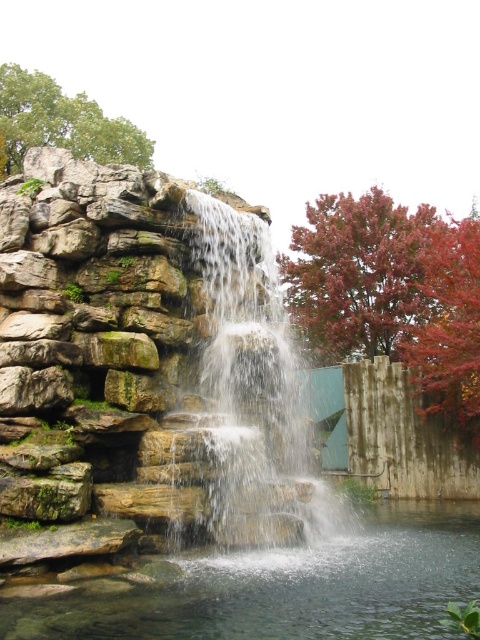
What are the coordinates of `rocky textured waterfall at center` in the screenshot? It's located at (253, 394).

Locate an element on the screen. rocky textured waterfall at center is located at coordinates (253, 394).

Find the location of a particular element. The width and height of the screenshot is (480, 640). rocky textured waterfall at center is located at coordinates 253,394.

Is clear water at center positioned in front of rocky textured waterfall at center?

That is True.

Can you confirm if clear water at center is wider than rocky textured waterfall at center?

Yes.

The height and width of the screenshot is (640, 480). What do you see at coordinates (288, 586) in the screenshot?
I see `clear water at center` at bounding box center [288, 586].

Find the location of a particular element. The height and width of the screenshot is (640, 480). clear water at center is located at coordinates (288, 586).

Is point (308, 291) positioned before point (36, 81)?

Yes, point (308, 291) is in front of point (36, 81).

Is reddish-brown textured tree at upper right further to camera compared to green leafy tree at upper left?

No, reddish-brown textured tree at upper right is closer to the viewer.

Is point (298, 285) closer to camera compared to point (109, 138)?

Yes, it is.

This screenshot has height=640, width=480. Find the location of `reddish-brown textured tree at upper right`. reddish-brown textured tree at upper right is located at coordinates (358, 273).